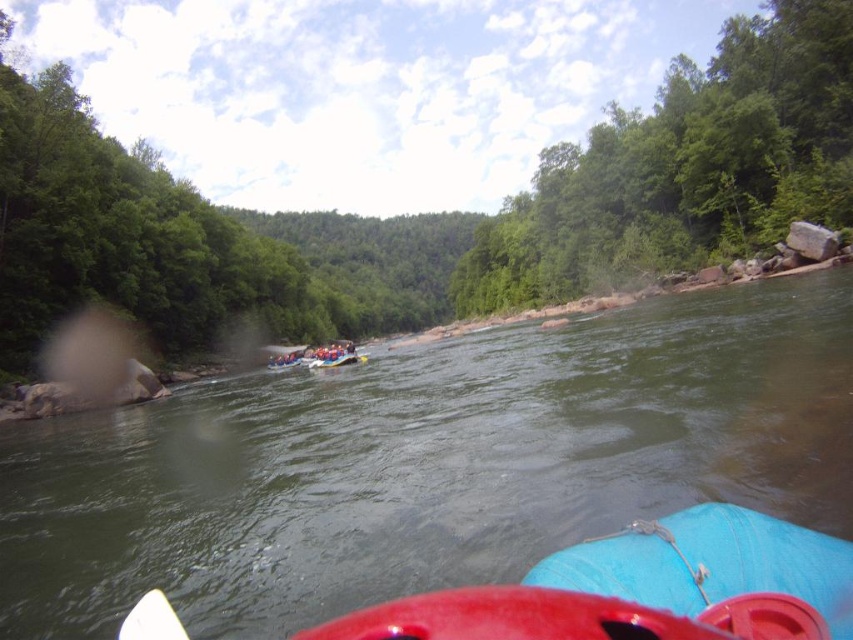
Does point (488, 484) come closer to viewer compared to point (183, 636)?

That is False.

Does green rubber raft at center have a smaller size compared to white plastic paddle at lower center?

Incorrect, green rubber raft at center is not smaller in size than white plastic paddle at lower center.

Which is behind, point (132, 508) or point (152, 636)?

Positioned behind is point (132, 508).

Locate an element on the screen. This screenshot has width=853, height=640. green rubber raft at center is located at coordinates (427, 464).

Does green rubber raft at center have a greater width compared to blue rubber canoe at lower right?

Yes, green rubber raft at center is wider than blue rubber canoe at lower right.

Who is taller, green rubber raft at center or blue rubber canoe at lower right?

With more height is green rubber raft at center.

I want to click on green rubber raft at center, so pos(427,464).

Between blue rubber canoe at lower right and white plastic paddle at lower center, which one is positioned higher?

Positioned higher is blue rubber canoe at lower right.

Consider the image. Which is more to the left, blue rubber canoe at lower right or white plastic paddle at lower center?

Result: white plastic paddle at lower center

This screenshot has width=853, height=640. Describe the element at coordinates (709, 564) in the screenshot. I see `blue rubber canoe at lower right` at that location.

Locate an element on the screen. The width and height of the screenshot is (853, 640). blue rubber canoe at lower right is located at coordinates tap(709, 564).